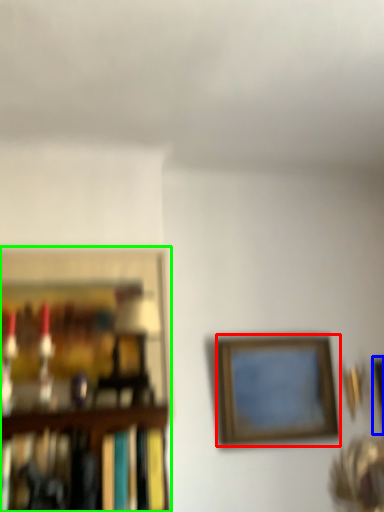
Question: Which object is positioned closest to picture frame (highlighted by a red box)? Select from picture frame (highlighted by a blue box) and picture frame (highlighted by a green box).

Choices:
 (A) picture frame
 (B) picture frame

Answer: (A)